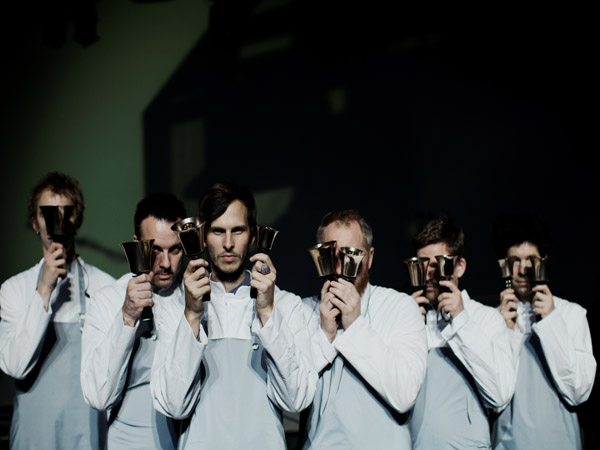
In order to click on aprons in this screenshot , I will do `click(53, 394)`, `click(124, 421)`, `click(236, 437)`, `click(387, 430)`, `click(450, 421)`, `click(559, 420)`.